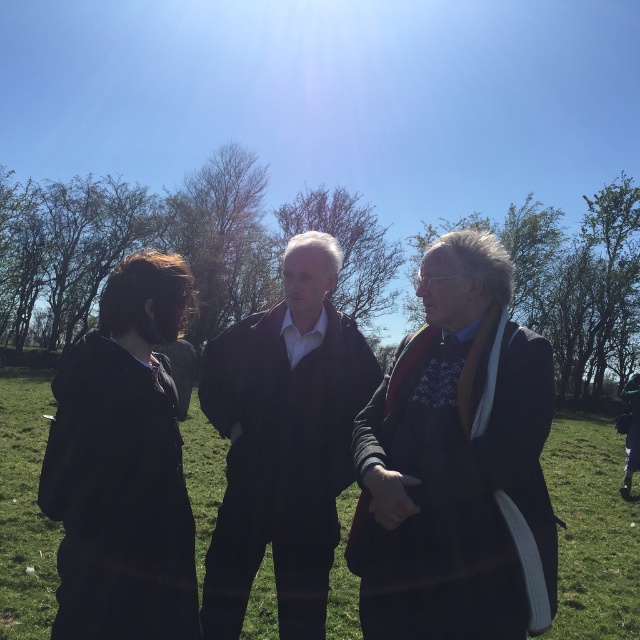
Based on the scene description, where is the dark gray suit at center located in the image?

The dark gray suit at center is located at point (456, 461).

What is the color of the suit worn by the individual located at point [456,461]?

The point [456,461] corresponds to the dark gray suit at center.

You are standing at the point with coordinates point (337, 268) and want to move to the point with coordinates point (428, 545). Is the destination point in front of or behind you?

The point (428, 545) is in front of the point (337, 268), so the destination point is in front of you.